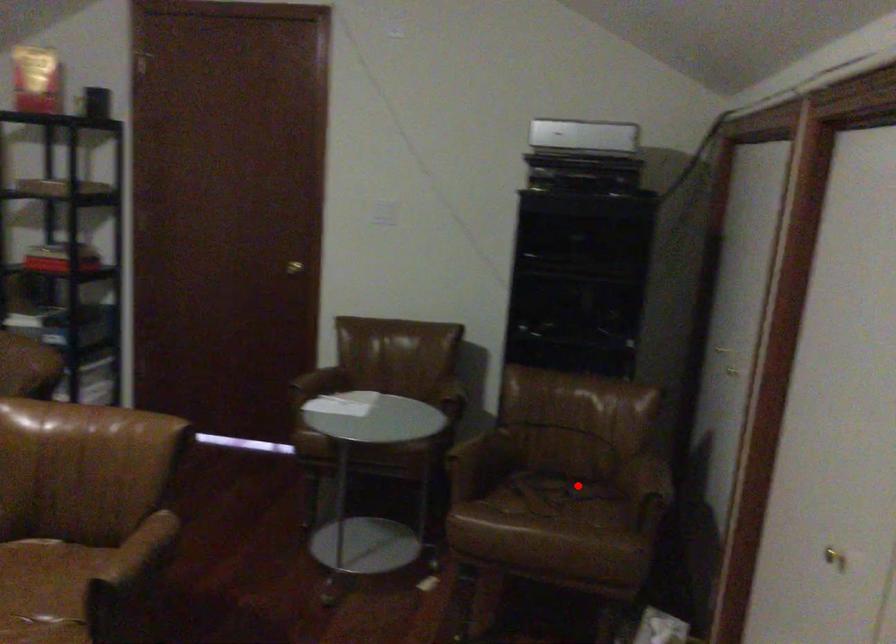
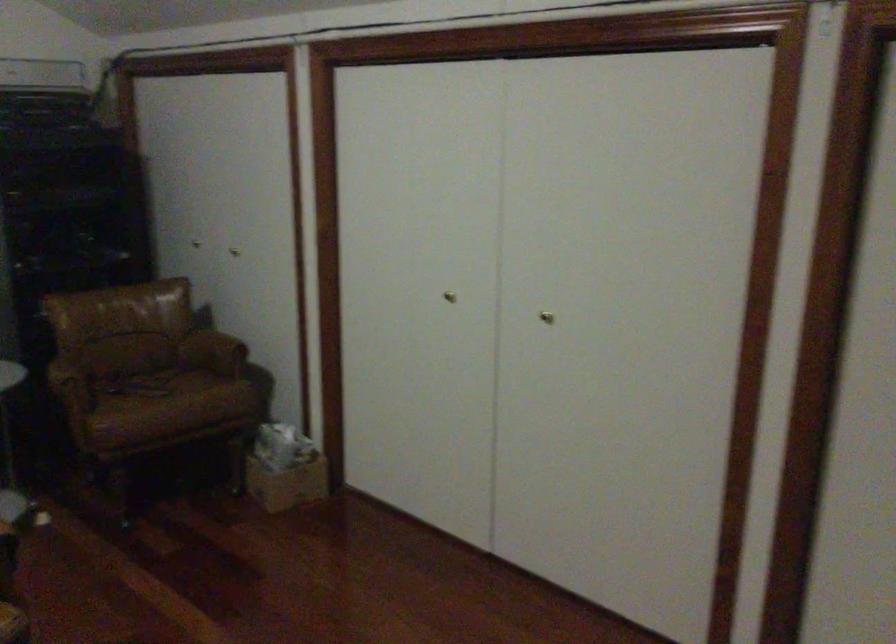
In the second image, find the point that corresponds to the highlighted location in the first image.

(149, 370)